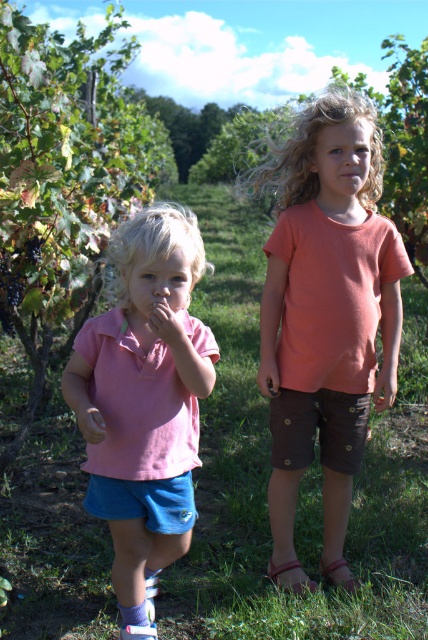
Is matte coral t-shirt at center to the left of pink cotton shirt at left from the viewer's perspective?

Incorrect, matte coral t-shirt at center is not on the left side of pink cotton shirt at left.

Does matte coral t-shirt at center have a lesser height compared to pink cotton shirt at left?

In fact, matte coral t-shirt at center may be taller than pink cotton shirt at left.

Is point (303, 163) positioned after point (190, 536)?

Yes, it is.

This screenshot has width=428, height=640. I want to click on matte coral t-shirt at center, so point(326,316).